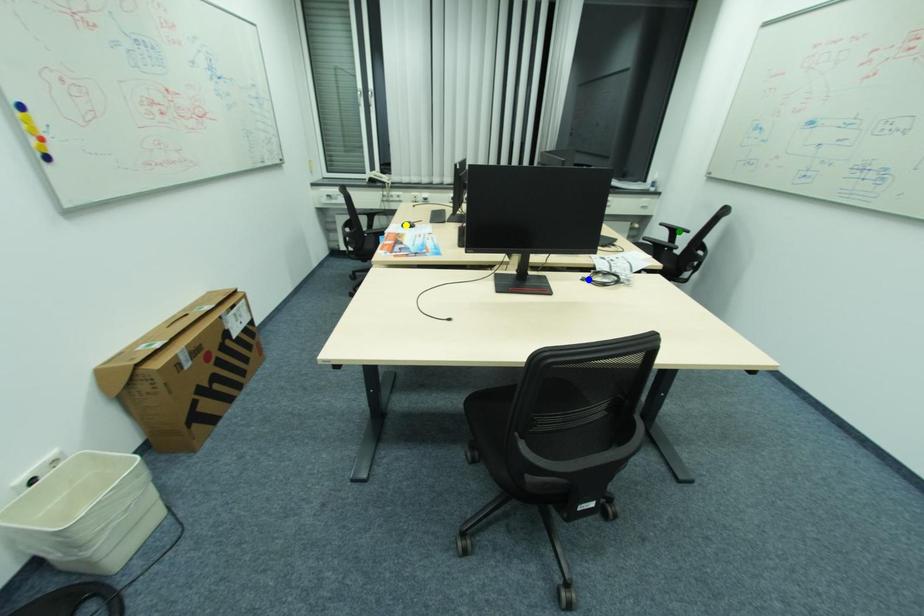
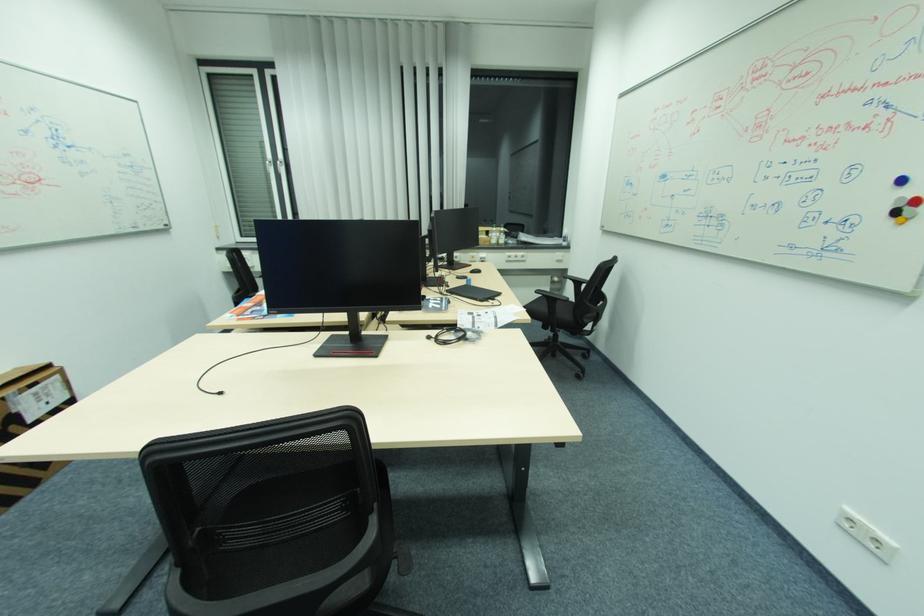
I am providing you with two images of the same scene from different viewpoints. Three points are marked in image1. Which point corresponds to a part or object that is occluded in image2?In image1, three points are marked. Which of them correspond to a part or object that is occluded in image2?Among the three points shown in image1, which one corresponds to a part or object that is no longer visible due to occlusion in image2?

Invisible in image2: yellow point.